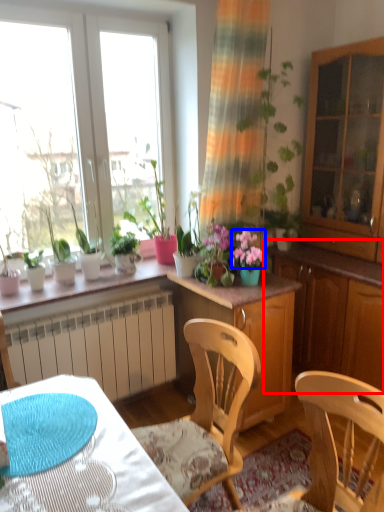
Question: Among these objects, which one is nearest to the camera, dresser (highlighted by a red box) or flower (highlighted by a blue box)?

Choices:
 (A) dresser
 (B) flower

Answer: (A)